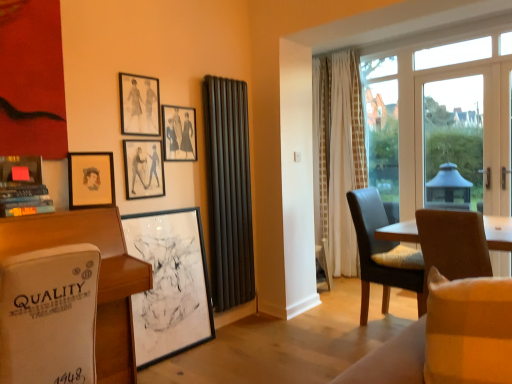
Question: Are matte brown chair at right, which is the 1th chair from back to front, and white glass door at right, arranged as the 1th window screen when viewed from the front, beside each other?

Choices:
 (A) yes
 (B) no

Answer: (B)

Question: From the image's perspective, is matte brown chair at right, placed as the 2th chair when sorted from front to back, above white glass door at right, the 2th window screen from the left?

Choices:
 (A) yes
 (B) no

Answer: (B)

Question: Is matte brown chair at right, which is the 1th chair from back to front, not close to white glass door at right, the second window screen viewed from the back?

Choices:
 (A) yes
 (B) no

Answer: (A)

Question: Is matte brown chair at right, which is the 1th chair from back to front, shorter than white glass door at right, arranged as the 1th window screen when viewed from the front?

Choices:
 (A) no
 (B) yes

Answer: (B)

Question: Does matte brown chair at right, which is the 1th chair from back to front, turn towards white glass door at right, arranged as the 1th window screen when viewed from the front?

Choices:
 (A) no
 (B) yes

Answer: (A)

Question: From the image's perspective, is matte brown chair at right, which is the 1th chair from back to front, above or below matte black radiator at center, the first curtain from the left?

Choices:
 (A) below
 (B) above

Answer: (A)

Question: From a real-world perspective, is matte brown chair at right, which is the 1th chair from back to front, physically located above or below matte black radiator at center, which appears as the 2th curtain when viewed from the back?

Choices:
 (A) below
 (B) above

Answer: (A)

Question: Is matte brown chair at right, which is the 1th chair from back to front, to the left or to the right of matte black radiator at center, which appears as the 2th curtain when viewed from the back, in the image?

Choices:
 (A) right
 (B) left

Answer: (A)

Question: Is point (364, 249) closer or farther from the camera than point (232, 94)?

Choices:
 (A) farther
 (B) closer

Answer: (B)

Question: Is white leather desk at lower left bigger or smaller than white glass door at right, the second window screen viewed from the back?

Choices:
 (A) big
 (B) small

Answer: (A)

Question: Would you say white leather desk at lower left is inside or outside white glass door at right, arranged as the 1th window screen when viewed from the front?

Choices:
 (A) inside
 (B) outside

Answer: (B)

Question: Is point (103, 307) closer or farther from the camera than point (454, 132)?

Choices:
 (A) closer
 (B) farther

Answer: (A)

Question: In terms of height, does white leather desk at lower left look taller or shorter compared to white glass door at right, the 2th window screen from the left?

Choices:
 (A) short
 (B) tall

Answer: (A)

Question: Considering their positions, is white glass door at right, the second window screen viewed from the back, located in front of or behind matte black picture frame at upper left, marked as the 4th picture frame in a top-to-bottom arrangement?

Choices:
 (A) front
 (B) behind

Answer: (B)

Question: Do you think white glass door at right, the 2th window screen from the left, is within matte black picture frame at upper left, marked as the 4th picture frame in a top-to-bottom arrangement, or outside of it?

Choices:
 (A) outside
 (B) inside

Answer: (A)